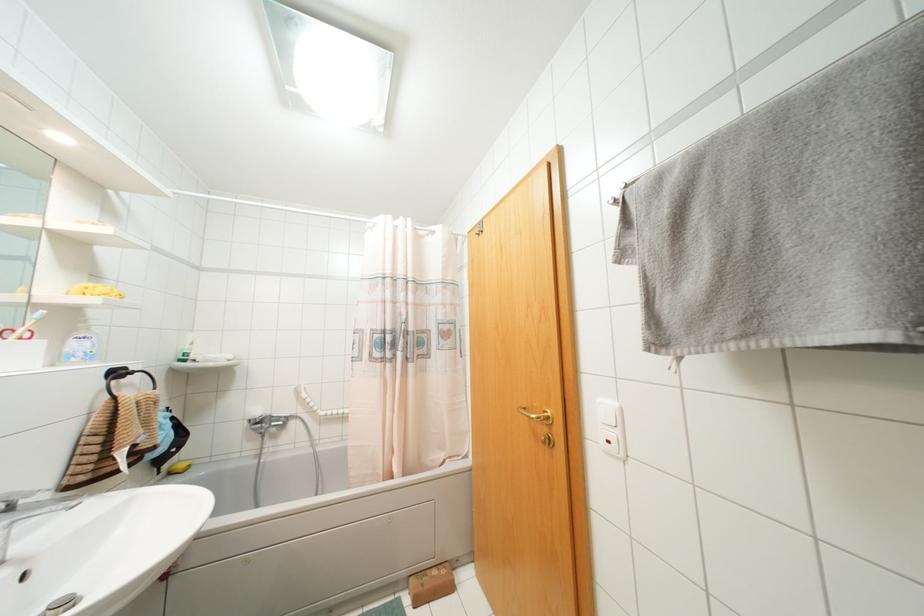
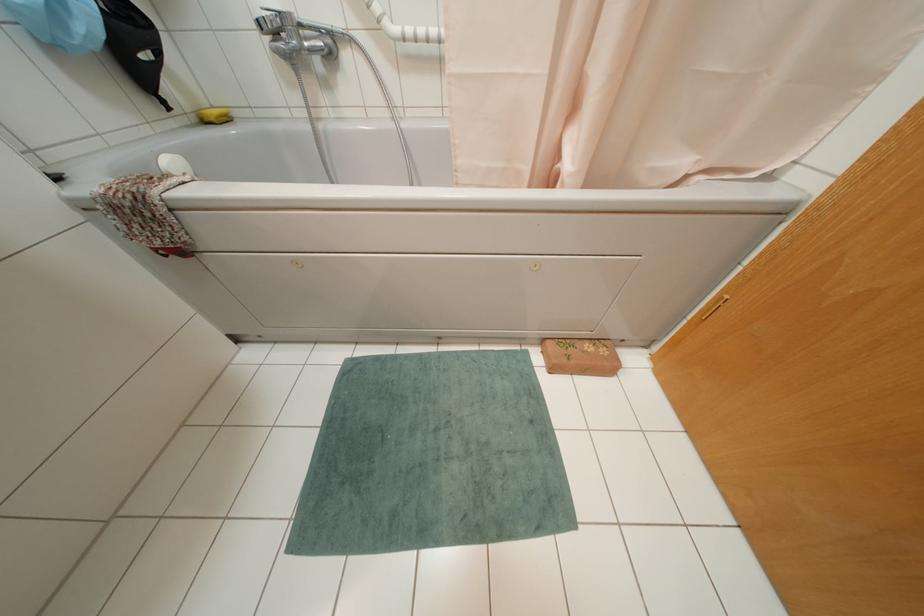
The point at (169,472) is marked in the first image. Where is the corresponding point in the second image?

(202, 121)